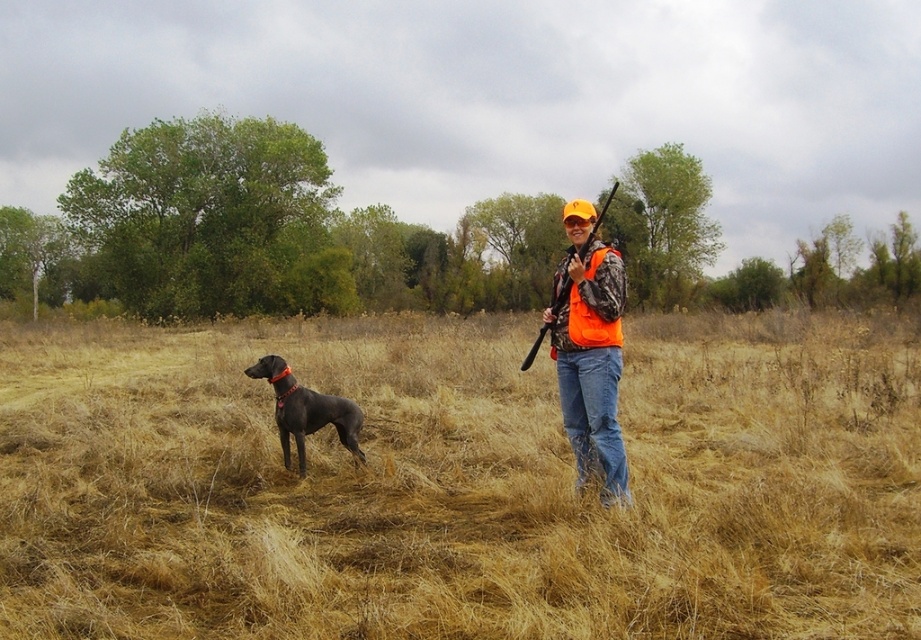
Describe the element at coordinates (306, 410) in the screenshot. Image resolution: width=921 pixels, height=640 pixels. I see `shiny black dog at center` at that location.

Is shiny black dog at center positioned in front of orange matte safety goggles at upper center?

No.

Is point (294, 392) more distant than point (583, 220)?

That is True.

Where is `shiny black dog at center`? shiny black dog at center is located at coordinates [x=306, y=410].

Is orange camo vest at center shorter than orange matte safety goggles at upper center?

No.

Who is positioned more to the left, orange camo vest at center or orange matte safety goggles at upper center?

From the viewer's perspective, orange camo vest at center appears more on the left side.

Find the location of a particular element. The image size is (921, 640). orange camo vest at center is located at coordinates (590, 358).

Which is below, dry grass at center or shiny black dog at center?

shiny black dog at center is below.

Describe the element at coordinates (457, 486) in the screenshot. I see `dry grass at center` at that location.

Find the location of `dry grass at center`. dry grass at center is located at coordinates (457, 486).